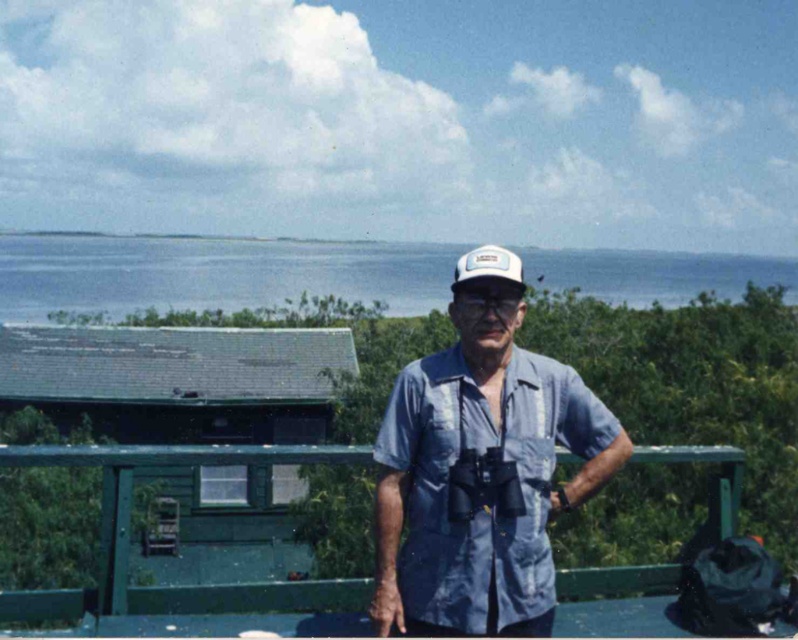
Question: Which of the following is the closest to the observer?

Choices:
 (A) (528, 259)
 (B) (709, 516)

Answer: (B)

Question: Which object is the closest to the white mesh cap at center?

Choices:
 (A) blue denim shirt at center
 (B) green painted wood at center
 (C) blue water at upper center

Answer: (A)

Question: Does blue water at upper center have a greater width compared to white mesh cap at center?

Choices:
 (A) yes
 (B) no

Answer: (A)

Question: In this image, where is blue denim shirt at center located relative to blue water at upper center?

Choices:
 (A) left
 (B) right

Answer: (A)

Question: Does blue water at upper center have a greater width compared to white mesh cap at center?

Choices:
 (A) yes
 (B) no

Answer: (A)

Question: Which of the following is the closest to the observer?

Choices:
 (A) (302, 250)
 (B) (504, 252)

Answer: (B)